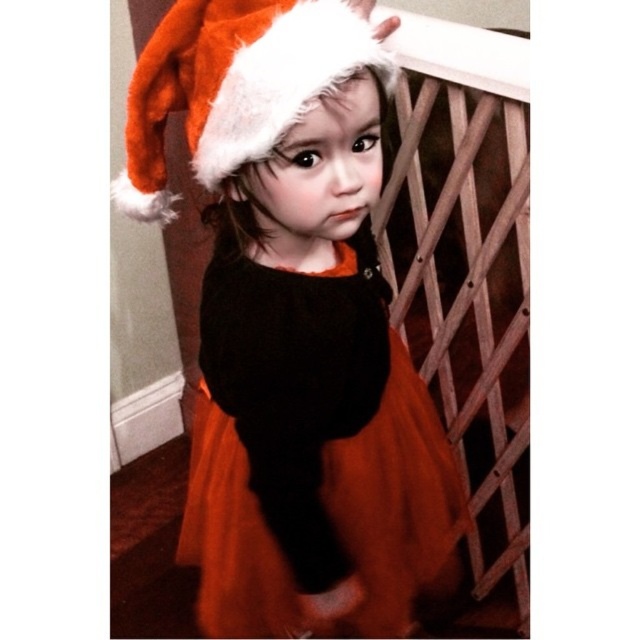
Does point (429, 115) come behind point (456, 508)?

Yes, point (429, 115) is farther from viewer.

Is point (420, 211) closer to camera compared to point (401, 380)?

No, (420, 211) is behind (401, 380).

Does point (522, 586) come in front of point (253, 504)?

No.

In order to click on wooden lattice at upper right in this screenshot , I will do `click(467, 275)`.

Can you confirm if wooden lattice at upper right is bigger than fuzzy orange santa hat at upper center?

Correct, wooden lattice at upper right is larger in size than fuzzy orange santa hat at upper center.

Between wooden lattice at upper right and fuzzy orange santa hat at upper center, which one is positioned lower?

wooden lattice at upper right is lower down.

Which is in front, point (500, 604) or point (154, 96)?

Point (154, 96) is more forward.

The image size is (640, 640). I want to click on wooden lattice at upper right, so click(x=467, y=275).

Can you confirm if orange tulle dress at center is smaller than fuzzy orange santa hat at upper center?

Actually, orange tulle dress at center might be larger than fuzzy orange santa hat at upper center.

Is point (198, 486) positioned behind point (280, 129)?

Yes.

The image size is (640, 640). In order to click on orange tulle dress at center in this screenshot , I will do `click(396, 500)`.